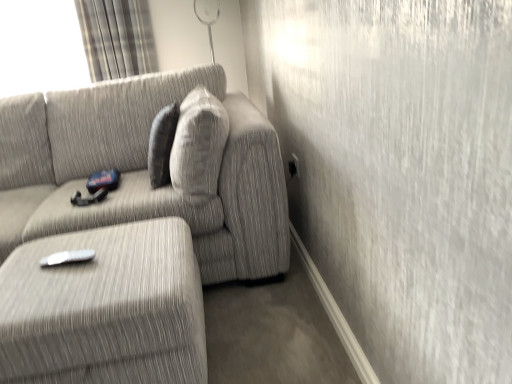
I want to click on vacant space situated above textured gray ottoman at lower left (from a real-world perspective), so click(87, 266).